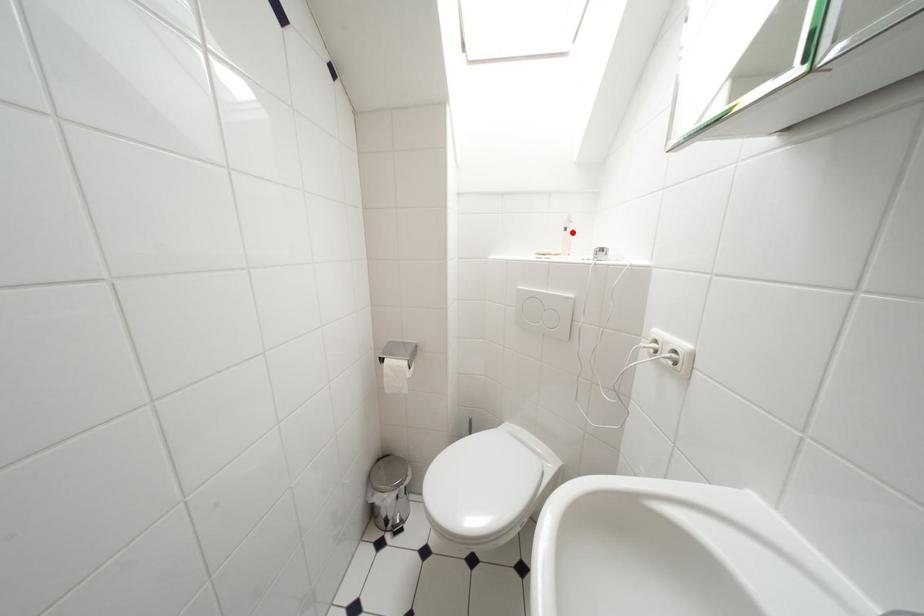
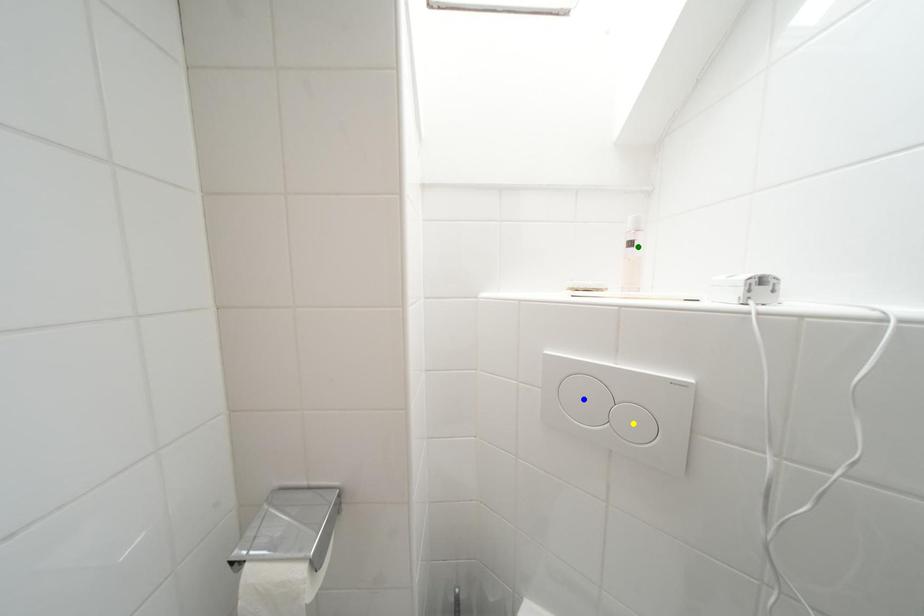
Question: I am providing you with two images of the same scene from different viewpoints. A red point is marked on the first image. You are given multiple points on the second image. Which point in image 2 is actually the same real-world point as the red point in image 1?

Choices:
 (A) green point
 (B) blue point
 (C) yellow point

Answer: (A)